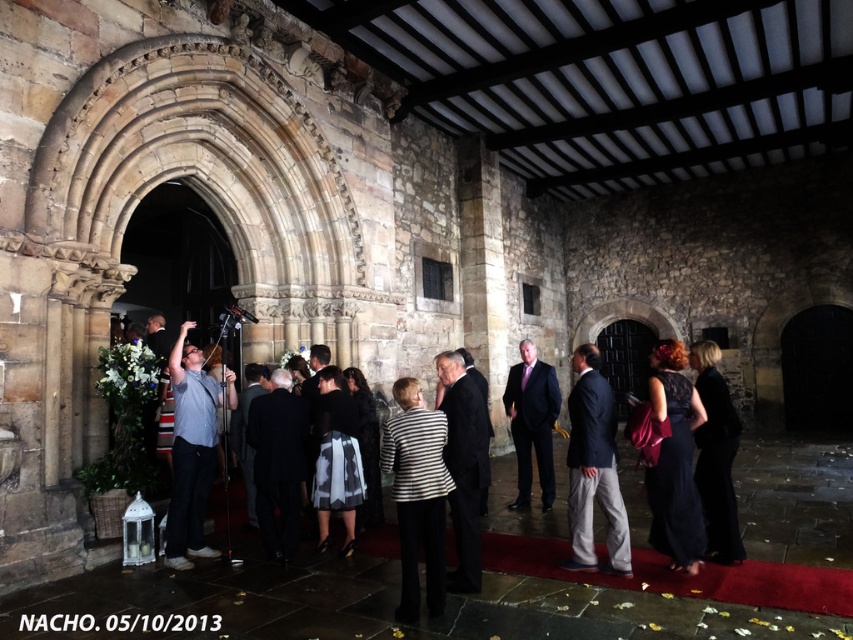
You are a photographer at the event and want to capture a photo of both the gray fabric shirt at center and the silky black dress at center. Which one is closer to the camera?

The gray fabric shirt at center is closer to the camera because the silky black dress at center is behind it.

Based on the photo, you are organizing a photo shoot and need to ensure that two outfits are displayed side by side. The gray fabric shirt at center and the silky black dress at center must be placed on mannequins. Since space is limited, you want to know which outfit takes up less width so you can arrange them appropriately. Which outfit is narrower?

The gray fabric shirt at center is thinner than the silky black dress at center, so it takes up less width and is narrower.